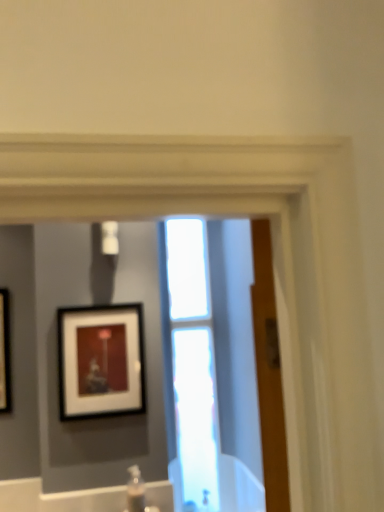
In order to face transparent glass window at center, should I rotate leftwards or rightwards?

You should rotate right by 0.096 degrees.

What is the approximate width of matte black picture frame at upper left?

5.03 centimeters.

You are a GUI agent. You are given a task and a screenshot of the screen. Output one action in this format:
    pyautogui.click(x=<x>, y=<y>)
    Task: Click on the clear plastic bottle at lower center
    This screenshot has width=384, height=512.
    Given the screenshot: What is the action you would take?
    pyautogui.click(x=135, y=490)

Find the location of `transparent glass window at center`. transparent glass window at center is located at coordinates pyautogui.click(x=189, y=361).

From a real-world perspective, between matte black picture frame at upper left and transparent glass window at center, who is vertically lower?

matte black picture frame at upper left.

Based on the photo, do you think matte black picture frame at upper left is within transparent glass window at center, or outside of it?

matte black picture frame at upper left cannot be found inside transparent glass window at center.

What's the angular difference between matte black picture frame at upper left and transparent glass window at center's facing directions?

The angular difference between matte black picture frame at upper left and transparent glass window at center is 0.594 degrees.

Based on the photo, would you say matte black picture frame at upper left is a long distance from transparent glass window at center?

Actually, matte black picture frame at upper left and transparent glass window at center are a little close together.

How many degrees apart are the facing directions of matte black picture frame at upper left and clear plastic bottle at lower center?

The facing directions of matte black picture frame at upper left and clear plastic bottle at lower center are 2.34 degrees apart.

Considering the positions of objects matte black picture frame at upper left and clear plastic bottle at lower center in the image provided, who is more to the left, matte black picture frame at upper left or clear plastic bottle at lower center?

matte black picture frame at upper left is more to the left.

From a real-world perspective, who is located higher, matte black picture frame at upper left or clear plastic bottle at lower center?

matte black picture frame at upper left is physically above.

Considering the positions of objects matte black picture frame at upper left and clear plastic bottle at lower center in the image provided, who is in front, matte black picture frame at upper left or clear plastic bottle at lower center?

clear plastic bottle at lower center is in front.

How different are the orientations of clear plastic bottle at lower center and transparent glass window at center in degrees?

The angular difference between clear plastic bottle at lower center and transparent glass window at center is 1.74 degrees.

You are a GUI agent. You are given a task and a screenshot of the screen. Output one action in this format:
    pyautogui.click(x=<x>, y=<y>)
    Task: Click on the plumbing fixture below the transparent glass window at center (from the image's perspective)
    Image resolution: width=384 pixels, height=512 pixels.
    Given the screenshot: What is the action you would take?
    pyautogui.click(x=135, y=490)

Which is nearer, (x=137, y=475) or (x=209, y=329)?

Point (x=137, y=475) is closer to the camera than point (x=209, y=329).

In the scene shown: Based on their sizes in the image, would you say clear plastic bottle at lower center is bigger or smaller than transparent glass window at center?

Clearly, clear plastic bottle at lower center is smaller in size than transparent glass window at center.

Considering their positions, is clear plastic bottle at lower center located in front of or behind matte black picture frame at upper left?

Clearly, clear plastic bottle at lower center is in front of matte black picture frame at upper left.

Considering the relative sizes of clear plastic bottle at lower center and matte black picture frame at upper left in the image provided, is clear plastic bottle at lower center bigger than matte black picture frame at upper left?

Incorrect, clear plastic bottle at lower center is not larger than matte black picture frame at upper left.

You are a GUI agent. You are given a task and a screenshot of the screen. Output one action in this format:
    pyautogui.click(x=<x>, y=<y>)
    Task: Click on the plumbing fixture below the matte black picture frame at upper left (from the image's perspective)
    
    Given the screenshot: What is the action you would take?
    pyautogui.click(x=135, y=490)

Which object is positioned more to the right, clear plastic bottle at lower center or matte black picture frame at upper left?

clear plastic bottle at lower center is more to the right.

Does point (199, 265) come farther from viewer compared to point (106, 387)?

Yes.

How much distance is there between transparent glass window at center and matte black picture frame at upper left?

A distance of 14.19 inches exists between transparent glass window at center and matte black picture frame at upper left.

Could you tell me if transparent glass window at center is facing matte black picture frame at upper left?

No, transparent glass window at center is not turned towards matte black picture frame at upper left.

Does transparent glass window at center have a lesser height compared to clear plastic bottle at lower center?

No.

Is transparent glass window at center behind clear plastic bottle at lower center?

Yes, transparent glass window at center is behind clear plastic bottle at lower center.

From a real-world perspective, is transparent glass window at center positioned above or below clear plastic bottle at lower center?

In terms of real-world spatial position, transparent glass window at center is above clear plastic bottle at lower center.

From the picture: Between transparent glass window at center and clear plastic bottle at lower center, which one has larger size?

transparent glass window at center is bigger.

The height and width of the screenshot is (512, 384). In order to click on picture frame on the left side of transparent glass window at center in this screenshot , I will do `click(100, 361)`.

Where is `plumbing fixture that appears below the matte black picture frame at upper left (from a real-world perspective)`? The image size is (384, 512). plumbing fixture that appears below the matte black picture frame at upper left (from a real-world perspective) is located at coordinates (135, 490).

Estimate the real-world distances between objects in this image. Which object is closer to transparent glass window at center, clear plastic bottle at lower center or matte black picture frame at upper left?

Among the two, matte black picture frame at upper left is located nearer to transparent glass window at center.

When comparing their distances from clear plastic bottle at lower center, does transparent glass window at center or matte black picture frame at upper left seem closer?

Among the two, matte black picture frame at upper left is located nearer to clear plastic bottle at lower center.

When comparing their distances from matte black picture frame at upper left, does clear plastic bottle at lower center or transparent glass window at center seem further?

Among the two, clear plastic bottle at lower center is located further to matte black picture frame at upper left.

From the image, which object appears to be farther from matte black picture frame at upper left, transparent glass window at center or clear plastic bottle at lower center?

The object further to matte black picture frame at upper left is clear plastic bottle at lower center.

Based on their spatial positions, is matte black picture frame at upper left or transparent glass window at center further from clear plastic bottle at lower center?

Among the two, transparent glass window at center is located further to clear plastic bottle at lower center.

Which object lies further to the anchor point transparent glass window at center, matte black picture frame at upper left or clear plastic bottle at lower center?

clear plastic bottle at lower center lies further to transparent glass window at center than the other object.

Where is `picture frame between transparent glass window at center and clear plastic bottle at lower center vertically`? picture frame between transparent glass window at center and clear plastic bottle at lower center vertically is located at coordinates (100, 361).